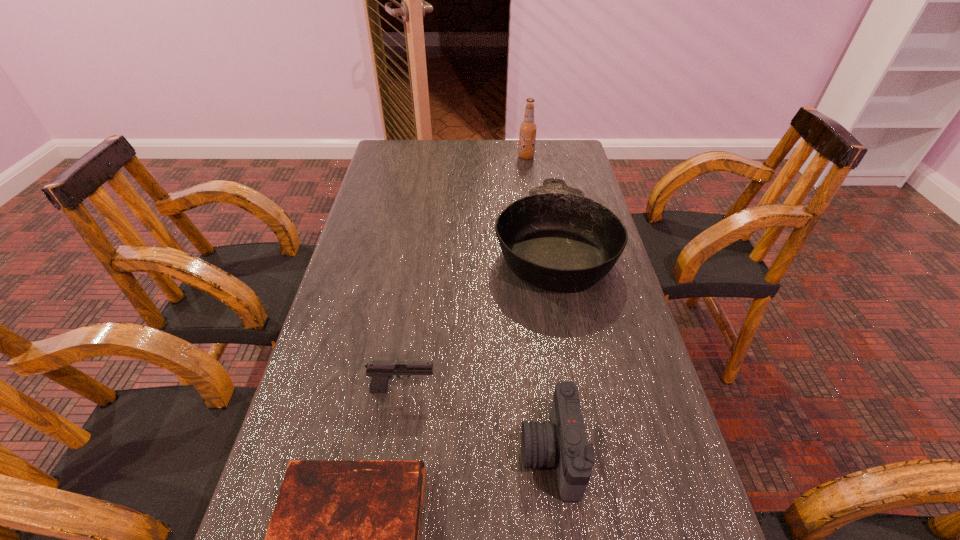
Locate an element on the screen. This screenshot has height=540, width=960. vacant space at the left edge of the desktop is located at coordinates (370, 348).

Where is `vacant point at the right edge`? Image resolution: width=960 pixels, height=540 pixels. vacant point at the right edge is located at coordinates (608, 392).

Locate an element on the screen. The image size is (960, 540). vacant point at the far left corner is located at coordinates (401, 162).

Identify the location of unoccupied position between the camera and the farthest object. This screenshot has height=540, width=960. (539, 305).

I want to click on empty location between the second farthest object and the camera, so click(x=552, y=349).

Where is `vacant space that is in between the fourth tallest object and the frying pan`? This screenshot has width=960, height=540. vacant space that is in between the fourth tallest object and the frying pan is located at coordinates (478, 318).

Select which object is the closest to the camera. Please provide its 2D coordinates. Your answer should be formatted as a tuple, i.e. [(x, y)], where the tuple contains the x and y coordinates of a point satisfying the conditions above.

[(344, 538)]

Where is `object that ranks as the third closest to the farthest object`? The width and height of the screenshot is (960, 540). object that ranks as the third closest to the farthest object is located at coordinates (562, 441).

Find the location of `free space in the image that satisfies the following two spatial constraints: 1. on the front label of the farthest object; 2. with the handle extending from the side of the frying pan`. free space in the image that satisfies the following two spatial constraints: 1. on the front label of the farthest object; 2. with the handle extending from the side of the frying pan is located at coordinates (540, 246).

You are a GUI agent. You are given a task and a screenshot of the screen. Output one action in this format:
    pyautogui.click(x=<x>, y=<y>)
    Task: Click on the vacant region that satisfies the following two spatial constraints: 1. on the front label of the tallest object; 2. with the handle extending from the side of the fourth nearest object
    The height and width of the screenshot is (540, 960).
    Given the screenshot: What is the action you would take?
    pyautogui.click(x=540, y=246)